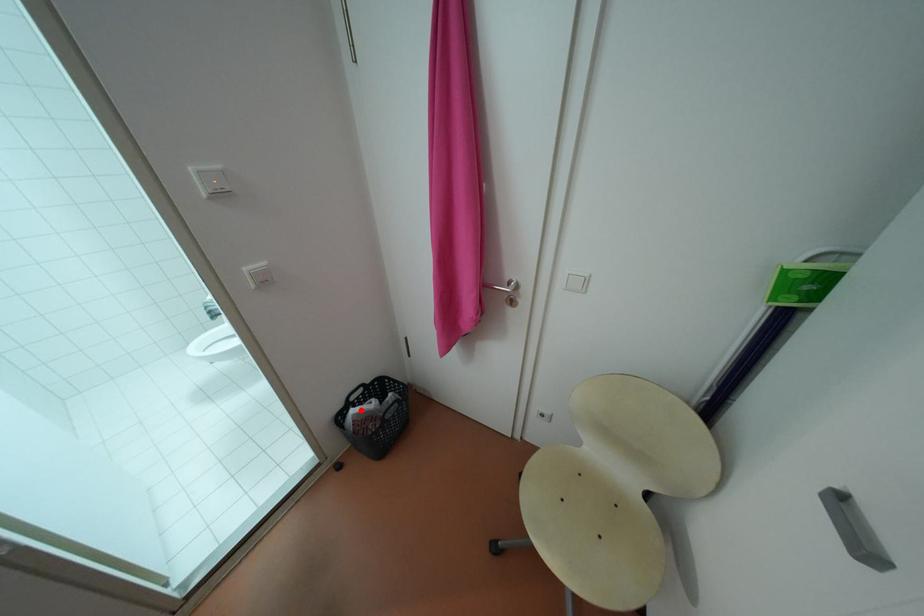
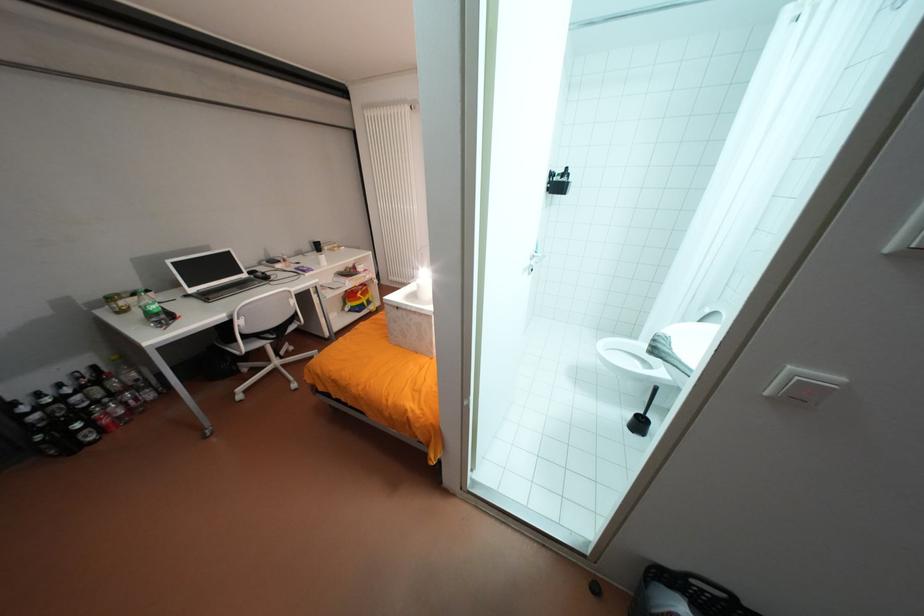
Question: I am providing you with two images of the same scene from different viewpoints. A red point is shown in image1. For the corresponding object point in image2, is it positioned nearer or farther from the camera?

Choices:
 (A) Nearer
 (B) Farther

Answer: (A)